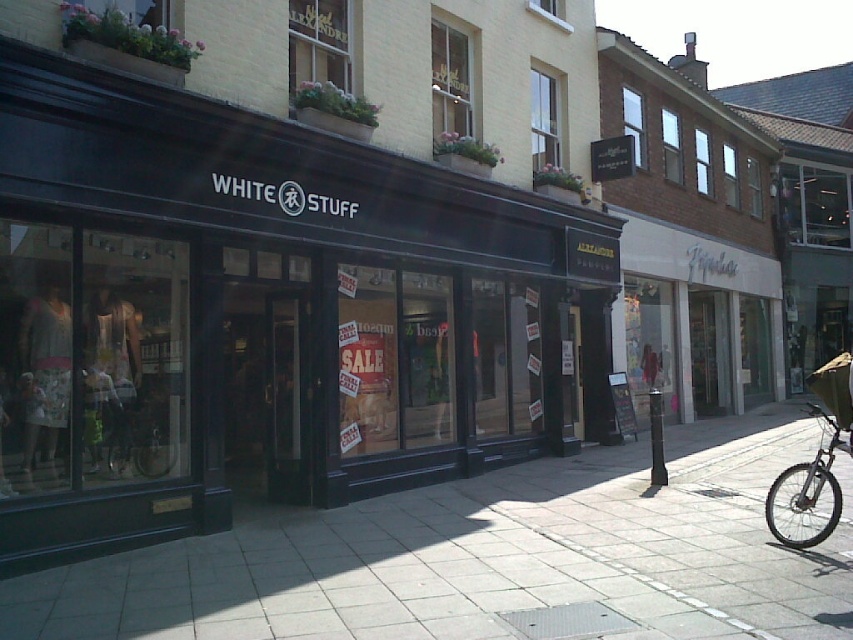
You are standing in front of the White Stuff store and need to locate two points marked on the facade. The first point is at coordinate point [628,577] and the second is at point [164,394]. Which point is closer to your current position?

Point [628,577] is closer to the camera than point [164,394], so the first point is closer to your current position.

You are a delivery person trying to park your bike near the White Stuff store. You see the black matte storefront at center and the smooth concrete pavement at center. Which object should you park your bike next to if you want to be on the right side of the storefront?

You should park your bike next to the smooth concrete pavement at center because the black matte storefront at center is to the left of it, meaning the smooth concrete pavement at center is on the right side of the storefront.

You are standing on the sidewalk in front of the White Stuff store. You see a point marked at coordinates (490, 557). What is located at that point?

The point at (490, 557) is where the smooth concrete pavement at center is located.